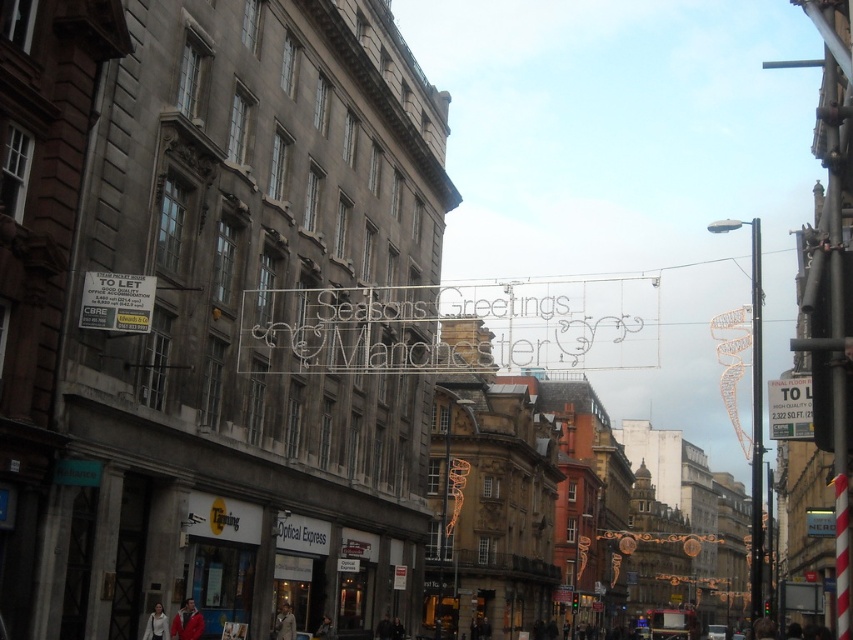
Question: Which of these objects is positioned closest to the red fabric jacket at lower left?

Choices:
 (A) white paper sign at left
 (B) light beige coat at center

Answer: (B)

Question: In this image, where is white paper sign at center located relative to white fabric jacket at lower left?

Choices:
 (A) below
 (B) above

Answer: (B)

Question: Which point is farther to the camera?

Choices:
 (A) (144, 280)
 (B) (805, 394)
 (C) (143, 636)
 (D) (286, 637)

Answer: (D)

Question: Does white paper sign at left appear on the left side of red fabric jacket at lower left?

Choices:
 (A) no
 (B) yes

Answer: (B)

Question: Which object appears closest to the camera in this image?

Choices:
 (A) white paper sign at left
 (B) red fabric jacket at lower left

Answer: (A)

Question: Observing the image, what is the correct spatial positioning of white paper sign at center in reference to white fabric jacket at lower left?

Choices:
 (A) left
 (B) right

Answer: (B)